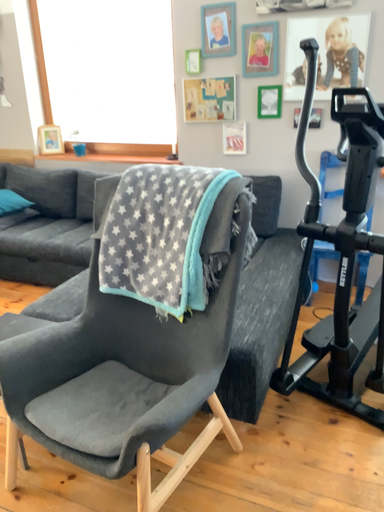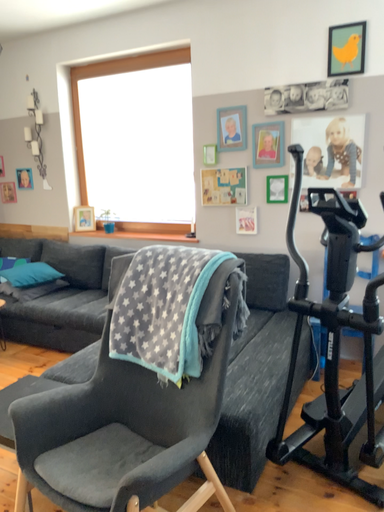
Question: Which way did the camera rotate in the video?

Choices:
 (A) rotated upward
 (B) rotated downward

Answer: (A)